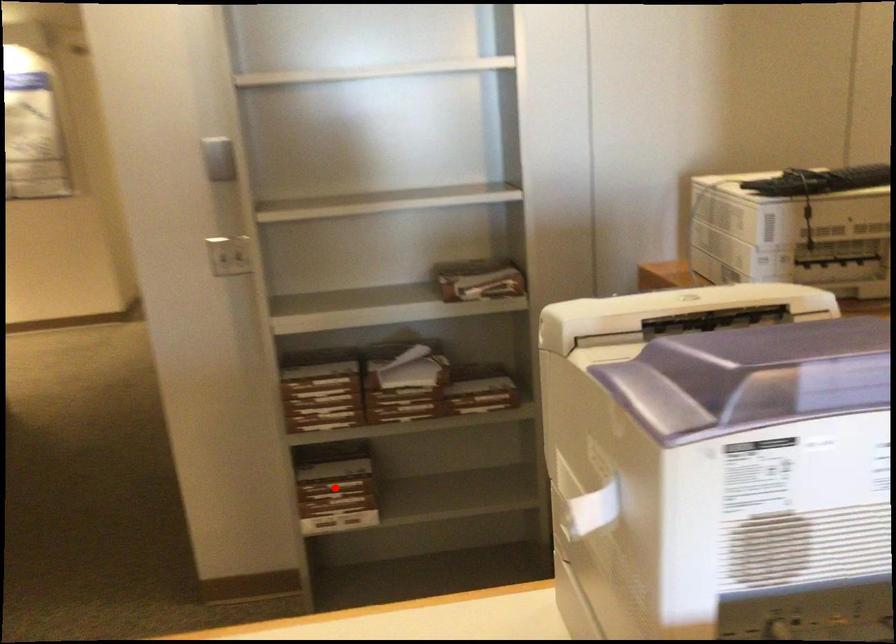
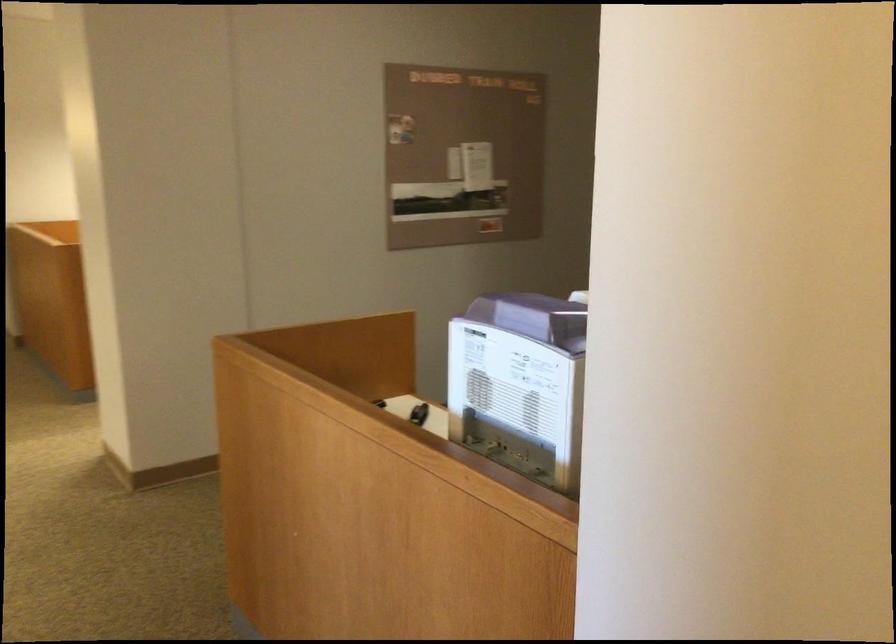
Question: I am providing you with two images of the same scene from different viewpoints. A red point is marked on the first image. At the location where the point appears in image 1, is it still visible in image 2?

Choices:
 (A) Yes
 (B) No

Answer: (B)